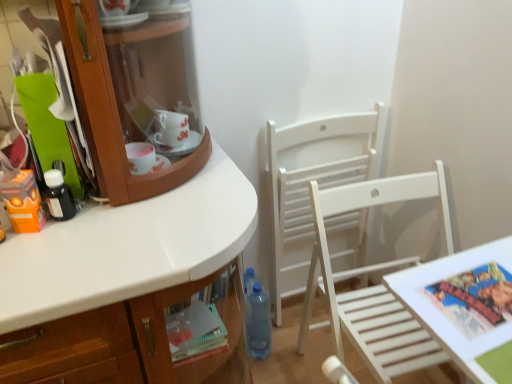
Question: Is blue translucent bottle at lower center, which appears as the second bottle when viewed from the left, facing away from white wood chair at center, which is the 1th chair from back to front?

Choices:
 (A) yes
 (B) no

Answer: (B)

Question: Are blue translucent bottle at lower center, the 2th bottle viewed from the front, and white wood chair at center, which is the 1th chair from back to front, beside each other?

Choices:
 (A) no
 (B) yes

Answer: (A)

Question: Does blue translucent bottle at lower center, the 2th bottle viewed from the front, have a greater height compared to white wood chair at center, which is the 1th chair from back to front?

Choices:
 (A) yes
 (B) no

Answer: (B)

Question: From the image's perspective, is blue translucent bottle at lower center, which ranks as the first bottle in bottom-to-top order, located above white wood chair at center, which is counted as the second chair, starting from the front?

Choices:
 (A) no
 (B) yes

Answer: (A)

Question: Does blue translucent bottle at lower center, arranged as the first bottle when viewed from the back, have a lesser width compared to white wood chair at center, which is the 1th chair from back to front?

Choices:
 (A) no
 (B) yes

Answer: (A)

Question: Looking at the image, does black matte bottle at left, the 1th bottle positioned from the left, seem bigger or smaller compared to white wood chair at center, the second chair in the back-to-front sequence?

Choices:
 (A) big
 (B) small

Answer: (B)

Question: Looking at their shapes, would you say black matte bottle at left, the 1th bottle positioned from the left, is wider or thinner than white wood chair at center, the second chair in the back-to-front sequence?

Choices:
 (A) wide
 (B) thin

Answer: (B)

Question: Is point (66, 205) positioned closer to the camera than point (356, 296)?

Choices:
 (A) farther
 (B) closer

Answer: (B)

Question: Is black matte bottle at left, marked as the second bottle in a bottom-to-top arrangement, taller or shorter than white wood chair at center, acting as the 1th chair starting from the front?

Choices:
 (A) short
 (B) tall

Answer: (A)

Question: From a real-world perspective, relative to white wooden table at lower right, is orange matte toy at left vertically above or below?

Choices:
 (A) below
 (B) above

Answer: (B)

Question: From the image's perspective, is orange matte toy at left located above or below white wooden table at lower right?

Choices:
 (A) above
 (B) below

Answer: (A)

Question: Relative to white wooden table at lower right, is orange matte toy at left in front or behind?

Choices:
 (A) behind
 (B) front

Answer: (A)

Question: Is orange matte toy at left wider or thinner than white wooden table at lower right?

Choices:
 (A) wide
 (B) thin

Answer: (B)

Question: In terms of height, does white wood chair at center, which is the 1th chair from back to front, look taller or shorter compared to orange matte toy at left?

Choices:
 (A) tall
 (B) short

Answer: (A)

Question: In the image, is white wood chair at center, which is counted as the second chair, starting from the front, positioned in front of or behind orange matte toy at left?

Choices:
 (A) front
 (B) behind

Answer: (B)